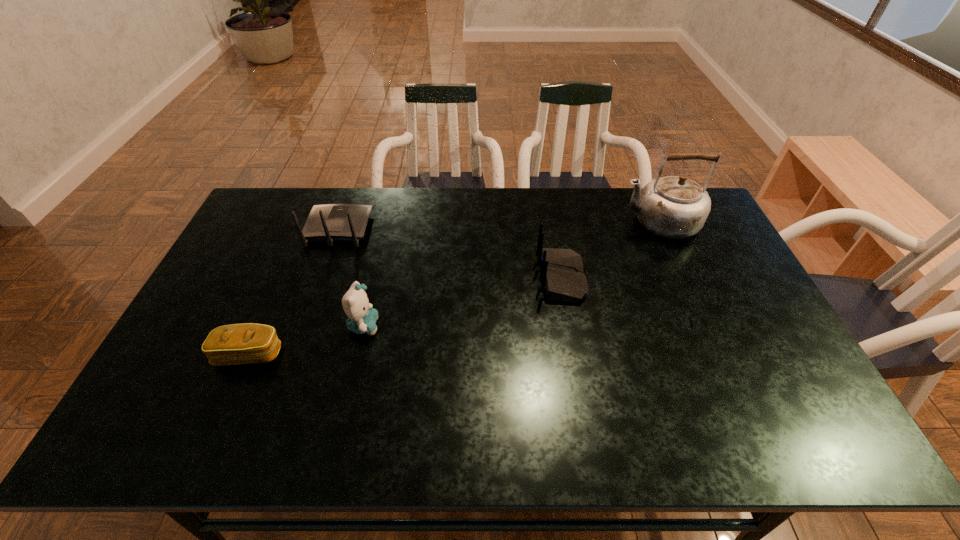
Locate an element on the screen. free location that satisfies the following two spatial constraints: 1. on the front-facing side of the left router; 2. at the spout of the kettle is located at coordinates pos(341,222).

The image size is (960, 540). Find the location of `vacant space that satisfies the following two spatial constraints: 1. on the back of the nearer router; 2. on the zipper side of the shortest object`. vacant space that satisfies the following two spatial constraints: 1. on the back of the nearer router; 2. on the zipper side of the shortest object is located at coordinates (575, 354).

You are a GUI agent. You are given a task and a screenshot of the screen. Output one action in this format:
    pyautogui.click(x=<x>, y=<y>)
    Task: Click on the vacant point that satisfies the following two spatial constraints: 1. on the back of the third farthest object; 2. on the zipper side of the clutch bag
    The width and height of the screenshot is (960, 540).
    Given the screenshot: What is the action you would take?
    pyautogui.click(x=575, y=354)